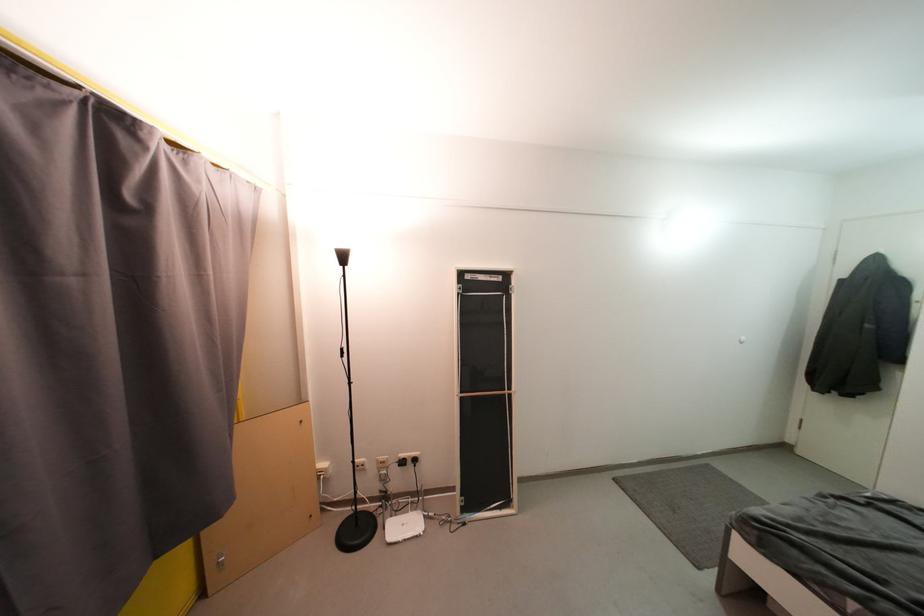
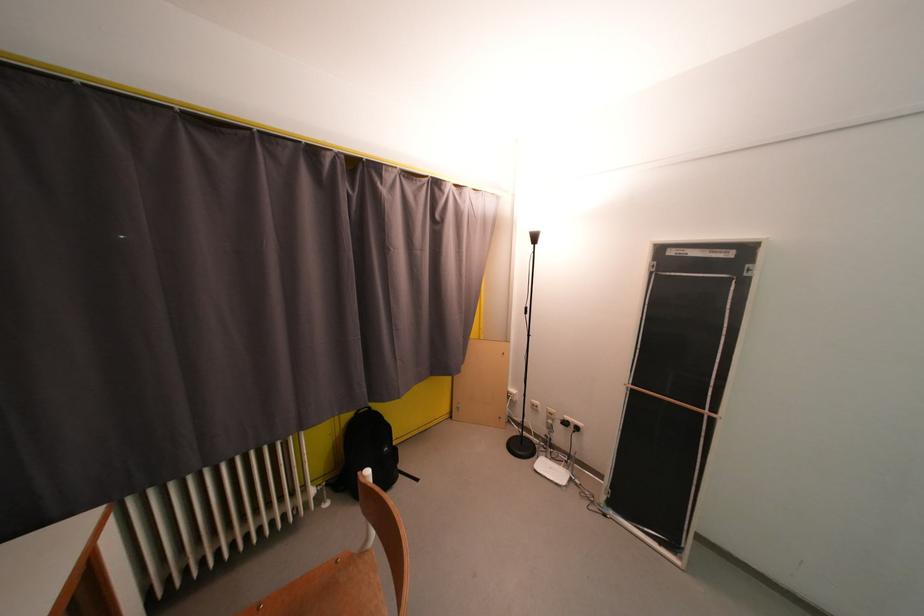
Question: The camera is either moving clockwise (left) or counter-clockwise (right) around the object. The first image is from the beginning of the video and the second image is from the end. Is the camera moving left or right when shooting the video?

Choices:
 (A) Left
 (B) Right

Answer: (B)